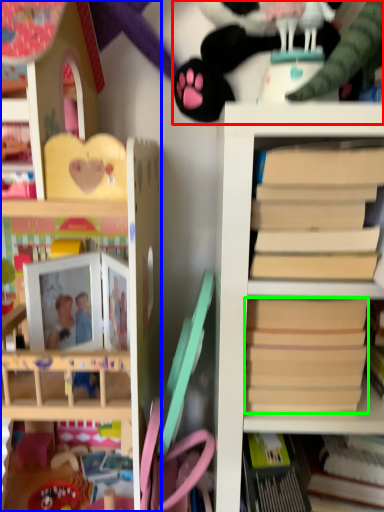
Question: Which object is positioned farthest from toy (highlighted by a red box)? Select from shelf (highlighted by a blue box) and paperback book (highlighted by a green box).

Choices:
 (A) shelf
 (B) paperback book

Answer: (B)